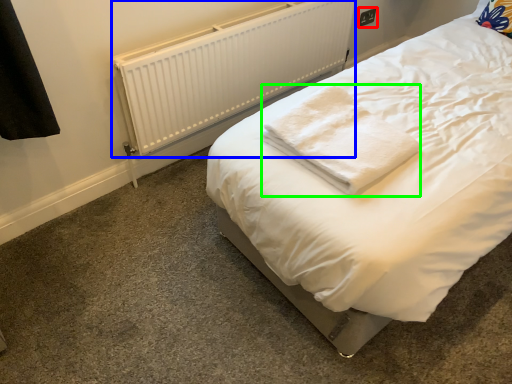
Question: Considering the real-world distances, which object is closest to electric outlet (highlighted by a red box)? radiator (highlighted by a blue box) or cloth (highlighted by a green box).

Choices:
 (A) radiator
 (B) cloth

Answer: (A)